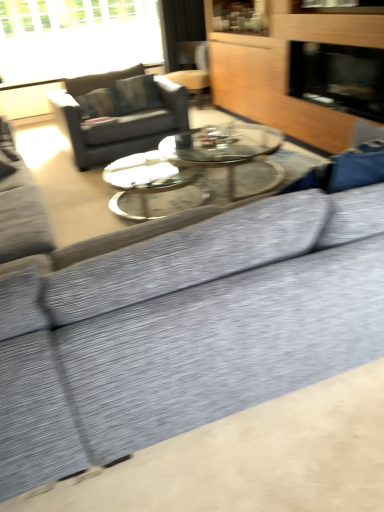
Image resolution: width=384 pixels, height=512 pixels. Identify the location of wooden swivel chair at upper center. (192, 69).

What is the approximate width of transparent glass window at upper left?

transparent glass window at upper left is 11.40 inches in width.

At what (x,y) coordinates should I click in order to perform the action: click on transparent glass window at upper left. Please return your answer as a coordinate pair (x, y). The height and width of the screenshot is (512, 384). Looking at the image, I should click on (75, 38).

What is the approximate width of dark gray fabric couch at upper left?

dark gray fabric couch at upper left is 1.13 meters in width.

The width and height of the screenshot is (384, 512). Find the location of `wooden swivel chair at upper center`. wooden swivel chair at upper center is located at coordinates (192, 69).

Is black glass fireplace at upper right thinner than wooden swivel chair at upper center?

Yes, black glass fireplace at upper right is thinner than wooden swivel chair at upper center.

From the image's perspective, between black glass fireplace at upper right and wooden swivel chair at upper center, who is located below?

black glass fireplace at upper right, from the image's perspective.

Is there a large distance between black glass fireplace at upper right and wooden swivel chair at upper center?

Yes, black glass fireplace at upper right and wooden swivel chair at upper center are quite far apart.

Is black glass fireplace at upper right spatially inside wooden swivel chair at upper center, or outside of it?

black glass fireplace at upper right is not enclosed by wooden swivel chair at upper center.

How different are the orientations of wooden dresser at upper right and black glass fireplace at upper right in degrees?

0.458 degrees separate the facing orientations of wooden dresser at upper right and black glass fireplace at upper right.

Is wooden dresser at upper right next to black glass fireplace at upper right and touching it?

wooden dresser at upper right is not next to black glass fireplace at upper right, and they're not touching.

Considering the sizes of objects wooden dresser at upper right and black glass fireplace at upper right in the image provided, who is smaller, wooden dresser at upper right or black glass fireplace at upper right?

black glass fireplace at upper right is smaller.

This screenshot has width=384, height=512. Find the location of `fireplace to the right of wooden dresser at upper right`. fireplace to the right of wooden dresser at upper right is located at coordinates (339, 77).

Do you think wooden dresser at upper right is within wooden swivel chair at upper center, or outside of it?

The correct answer is: outside.

Can you confirm if wooden dresser at upper right is wider than wooden swivel chair at upper center?

No.

Is wooden dresser at upper right smaller than wooden swivel chair at upper center?

No, wooden dresser at upper right is not smaller than wooden swivel chair at upper center.

Is wooden dresser at upper right oriented away from wooden swivel chair at upper center?

wooden dresser at upper right does not have its back to wooden swivel chair at upper center.

Can you tell me how much wooden swivel chair at upper center and wooden dresser at upper right differ in facing direction?

The angle between the facing direction of wooden swivel chair at upper center and the facing direction of wooden dresser at upper right is 30.6 degrees.

Could you tell me if wooden swivel chair at upper center is facing wooden dresser at upper right?

No, wooden swivel chair at upper center is not oriented towards wooden dresser at upper right.

Locate an element on the screen. The width and height of the screenshot is (384, 512). swivel chair on the left side of wooden dresser at upper right is located at coordinates (192, 69).

Which is in front, point (206, 51) or point (257, 54)?

The point (257, 54) is more forward.

Which object is further away from the camera, transparent glass window at upper left or wooden swivel chair at upper center?

wooden swivel chair at upper center is behind.

Would you say transparent glass window at upper left is a long distance from wooden swivel chair at upper center?

Absolutely, transparent glass window at upper left is distant from wooden swivel chair at upper center.

From the image's perspective, is transparent glass window at upper left above or below wooden swivel chair at upper center?

transparent glass window at upper left is above wooden swivel chair at upper center.

Is transparent glass window at upper left facing away from dark gray fabric couch at upper left?

transparent glass window at upper left is not turned away from dark gray fabric couch at upper left.

Is transparent glass window at upper left in front of or behind dark gray fabric couch at upper left in the image?

transparent glass window at upper left is behind dark gray fabric couch at upper left.

From a real-world perspective, is transparent glass window at upper left located higher than dark gray fabric couch at upper left?

Correct, in the physical world, transparent glass window at upper left is higher than dark gray fabric couch at upper left.

Is transparent glass window at upper left spatially inside dark gray fabric couch at upper left, or outside of it?

transparent glass window at upper left is outside dark gray fabric couch at upper left.

Looking at the image, does wooden dresser at upper right seem bigger or smaller compared to dark gray fabric couch at upper left?

Considering their sizes, wooden dresser at upper right takes up more space than dark gray fabric couch at upper left.

From the image's perspective, is wooden dresser at upper right beneath dark gray fabric couch at upper left?

No, from the image's perspective, wooden dresser at upper right is not below dark gray fabric couch at upper left.

Can you see wooden dresser at upper right touching dark gray fabric couch at upper left?

wooden dresser at upper right and dark gray fabric couch at upper left are clearly separated.

At what (x,y) coordinates should I click in order to perform the action: click on fireplace above the wooden swivel chair at upper center (from a real-world perspective). Please return your answer as a coordinate pair (x, y). The image size is (384, 512). Looking at the image, I should click on (339, 77).

At what (x,y) coordinates should I click in order to perform the action: click on fireplace below the wooden dresser at upper right (from the image's perspective). Please return your answer as a coordinate pair (x, y). The height and width of the screenshot is (512, 384). Looking at the image, I should click on (339, 77).

Estimate the real-world distances between objects in this image. Which object is closer to wooden dresser at upper right, wooden swivel chair at upper center or black glass fireplace at upper right?

The object closer to wooden dresser at upper right is black glass fireplace at upper right.

Estimate the real-world distances between objects in this image. Which object is closer to transparent glass window at upper left, wooden swivel chair at upper center or wooden dresser at upper right?

wooden swivel chair at upper center is closer to transparent glass window at upper left.

Considering their positions, is black glass fireplace at upper right positioned closer to dark gray fabric couch at upper left than wooden dresser at upper right?

Among the two, wooden dresser at upper right is located nearer to dark gray fabric couch at upper left.

Estimate the real-world distances between objects in this image. Which object is further from wooden dresser at upper right, transparent glass window at upper left or wooden swivel chair at upper center?

transparent glass window at upper left is positioned further to the anchor wooden dresser at upper right.

Consider the image. Considering their positions, is wooden swivel chair at upper center positioned closer to wooden dresser at upper right than dark gray fabric couch at upper left?

dark gray fabric couch at upper left lies closer to wooden dresser at upper right than the other object.

Estimate the real-world distances between objects in this image. Which object is closer to transparent glass window at upper left, black glass fireplace at upper right or wooden swivel chair at upper center?

wooden swivel chair at upper center lies closer to transparent glass window at upper left than the other object.

When comparing their distances from black glass fireplace at upper right, does wooden swivel chair at upper center or transparent glass window at upper left seem closer?

wooden swivel chair at upper center is closer to black glass fireplace at upper right.

Looking at the image, which one is located further to transparent glass window at upper left, wooden swivel chair at upper center or black glass fireplace at upper right?

black glass fireplace at upper right is further to transparent glass window at upper left.

Locate an element on the screen. The height and width of the screenshot is (512, 384). studio couch located between wooden dresser at upper right and wooden swivel chair at upper center in the depth direction is located at coordinates (119, 114).

Identify the location of dresser between dark gray fabric couch at upper left and black glass fireplace at upper right. The image size is (384, 512). (284, 70).

Identify the location of studio couch between wooden dresser at upper right and transparent glass window at upper left along the z-axis. (119, 114).

You are a GUI agent. You are given a task and a screenshot of the screen. Output one action in this format:
    pyautogui.click(x=<x>, y=<y>)
    Task: Click on the studio couch between transparent glass window at upper left and black glass fireplace at upper right from left to right
    
    Given the screenshot: What is the action you would take?
    coord(119,114)